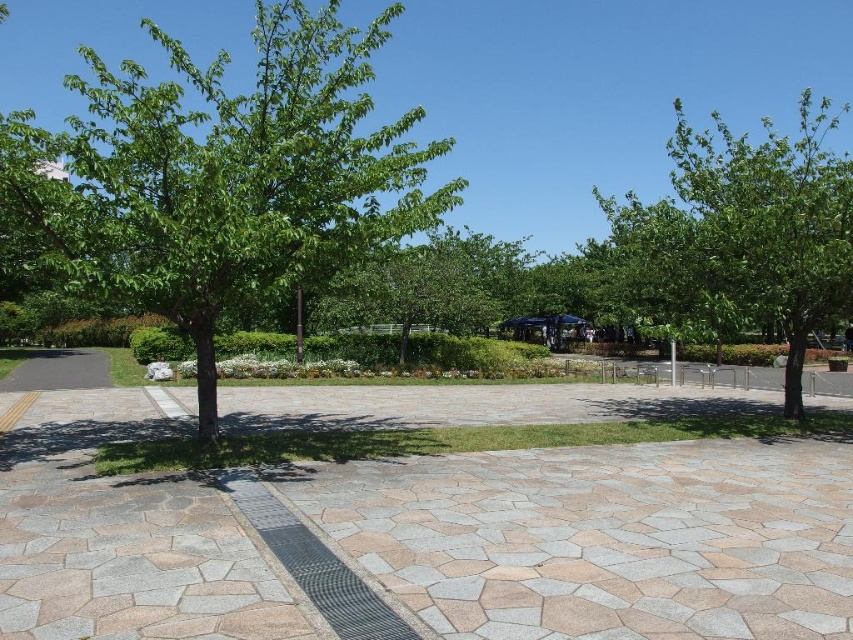
Question: Which of the following is the farthest from the observer?

Choices:
 (A) (639, 364)
 (B) (753, 224)

Answer: (A)

Question: Estimate the real-world distances between objects in this image. Which object is farther from the green leafy tree at left?

Choices:
 (A) green leafy tree at right
 (B) gray stone pavement at lower left

Answer: (A)

Question: Estimate the real-world distances between objects in this image. Which object is closer to the green leafy tree at right?

Choices:
 (A) gray stone pavement at lower left
 (B) metallic gray path at center

Answer: (A)

Question: Is green leafy tree at left to the right of metallic gray path at center from the viewer's perspective?

Choices:
 (A) no
 (B) yes

Answer: (A)

Question: Is gray stone pavement at lower left below wooden park bench at center?

Choices:
 (A) yes
 (B) no

Answer: (B)

Question: Can you confirm if gray stone pavement at lower left is wider than wooden park bench at center?

Choices:
 (A) no
 (B) yes

Answer: (B)